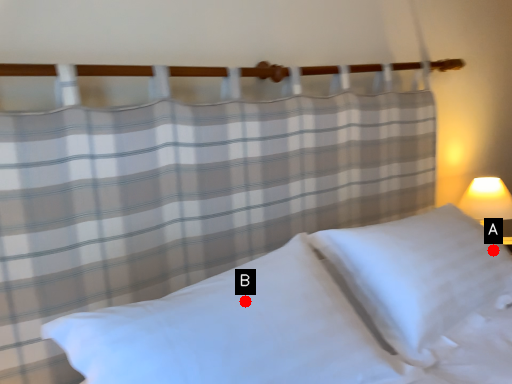
Question: Two points are circled on the image, labeled by A and B beside each circle. Which point appears farthest from the camera in this image?

Choices:
 (A) A is further
 (B) B is further

Answer: (A)